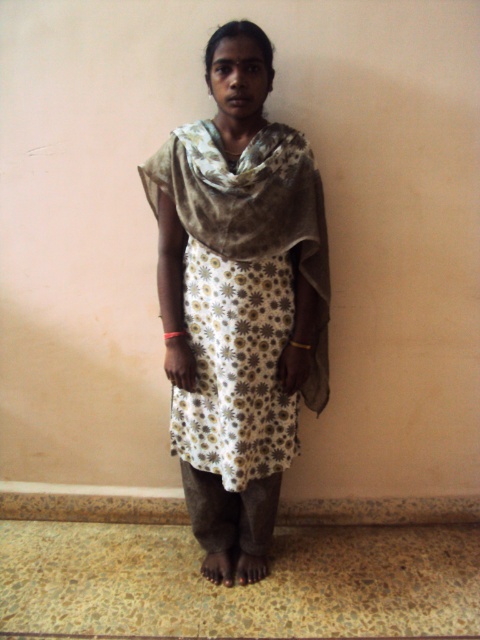
Does floral fabric dress at center appear under white floral fabric dress at center?

Actually, floral fabric dress at center is above white floral fabric dress at center.

Can you confirm if floral fabric dress at center is taller than white floral fabric dress at center?

Indeed, floral fabric dress at center has a greater height compared to white floral fabric dress at center.

Measure the distance between point (166, 186) and camera.

6.06 feet

Find the location of a particular element. floral fabric dress at center is located at coordinates (239, 301).